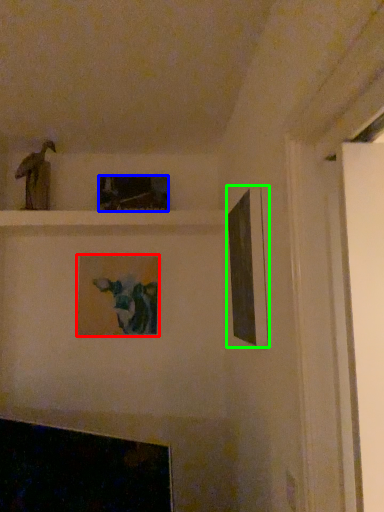
Question: Which is farther away from picture frame (highlighted by a red box)? picture frame (highlighted by a blue box) or picture frame (highlighted by a green box)?

Choices:
 (A) picture frame
 (B) picture frame

Answer: (B)